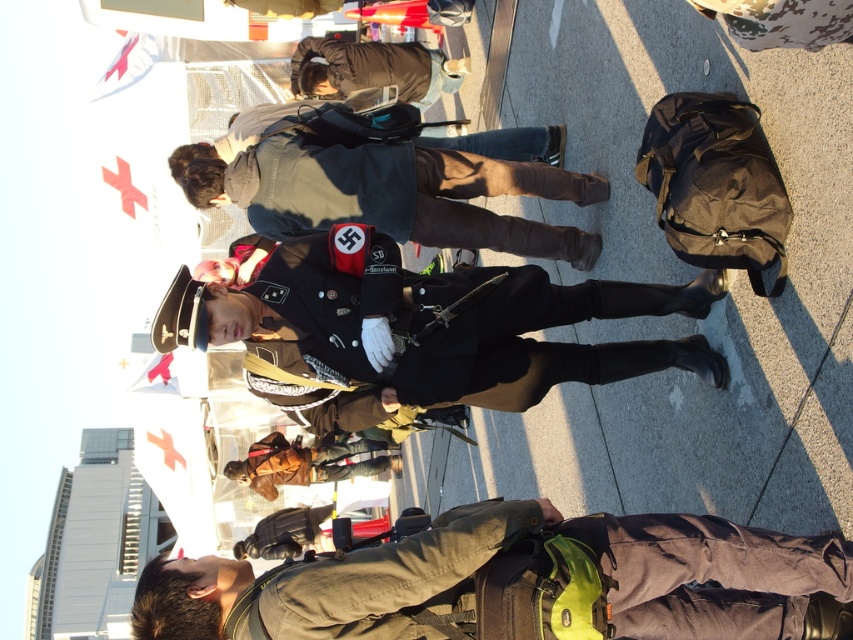
How far apart are brown fabric backpack at lower center and shiny black uniform at center?

The distance of brown fabric backpack at lower center from shiny black uniform at center is 9.20 meters.

Who is taller, brown fabric backpack at lower center or shiny black uniform at center?

shiny black uniform at center

The width and height of the screenshot is (853, 640). Describe the element at coordinates (520, 582) in the screenshot. I see `brown fabric backpack at lower center` at that location.

In order to click on brown fabric backpack at lower center in this screenshot , I will do `click(520, 582)`.

Who is more forward, (425, 92) or (286, 461)?

Positioned in front is point (425, 92).

Does dark brown leather jacket at upper center have a greater width compared to brown leather jacket at center?

No, dark brown leather jacket at upper center is not wider than brown leather jacket at center.

What do you see at coordinates (373, 68) in the screenshot?
I see `dark brown leather jacket at upper center` at bounding box center [373, 68].

Locate an element on the screen. dark brown leather jacket at upper center is located at coordinates pos(373,68).

Does dark gray fabric jacket at center have a smaller size compared to dark brown leather jacket at upper center?

Incorrect, dark gray fabric jacket at center is not smaller in size than dark brown leather jacket at upper center.

Measure the distance between point (303, 212) and camera.

Point (303, 212) is 43.92 meters from camera.

Measure the distance between dark gray fabric jacket at center and camera.

40.58 meters

You are a GUI agent. You are given a task and a screenshot of the screen. Output one action in this format:
    pyautogui.click(x=<x>, y=<y>)
    Task: Click on the dark gray fabric jacket at center
    
    Given the screenshot: What is the action you would take?
    pyautogui.click(x=390, y=193)